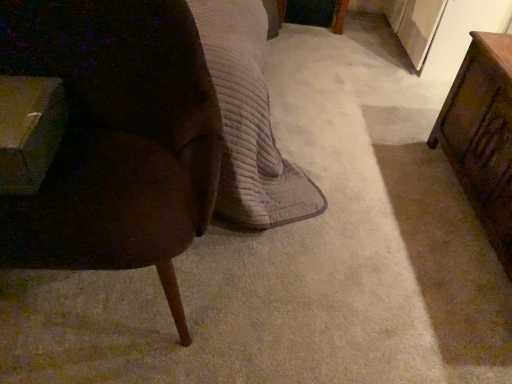
Question: Is velvet brown chair at left inside or outside of wooden table at right, the second table viewed from the left?

Choices:
 (A) inside
 (B) outside

Answer: (B)

Question: In the image, is velvet brown chair at left on the left side or the right side of wooden table at right, which is the first table in right-to-left order?

Choices:
 (A) right
 (B) left

Answer: (B)

Question: Estimate the real-world distances between objects in this image. Which object is closer to the wooden table at left, arranged as the 1th table when viewed from the left?

Choices:
 (A) wooden table at right, which is the first table in right-to-left order
 (B) velvet brown chair at left

Answer: (B)

Question: Based on their relative distances, which object is nearer to the velvet brown chair at left?

Choices:
 (A) wooden table at left, arranged as the second table when viewed from the right
 (B) wooden table at right, the second table viewed from the left

Answer: (A)